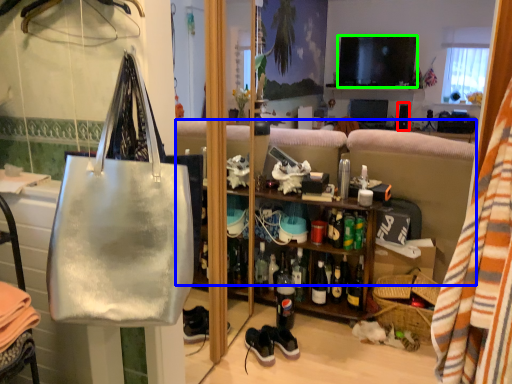
Question: Estimate the real-world distances between objects in this image. Which object is closer to loudspeaker (highlighted by a red box), studio couch (highlighted by a blue box) or television (highlighted by a green box)?

Choices:
 (A) studio couch
 (B) television

Answer: (B)